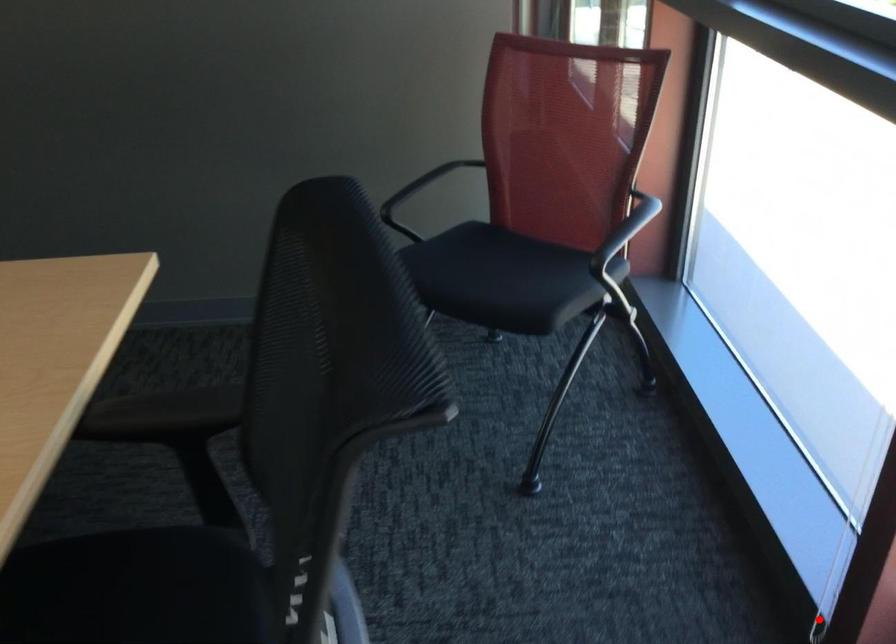
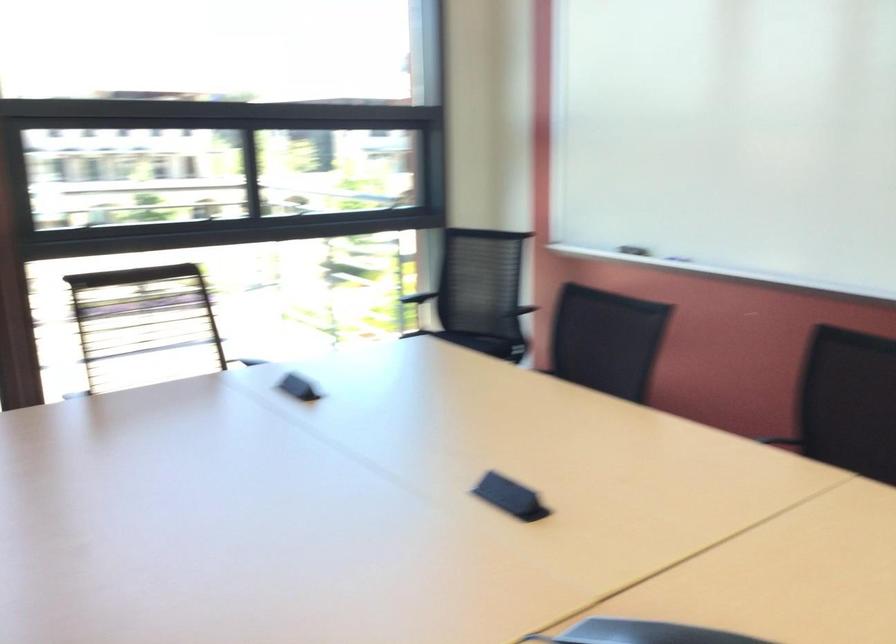
Question: I am providing you with two images of the same scene from different viewpoints. A red point is marked on the first image. At the location where the point appears in image 1, is it still visible in image 2?

Choices:
 (A) Yes
 (B) No

Answer: (B)